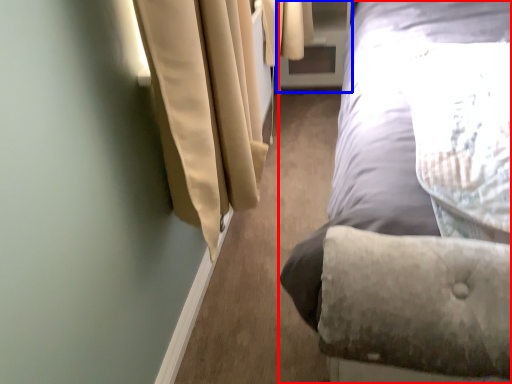
Question: Which object is further to the camera taking this photo, bed (highlighted by a red box) or screen door (highlighted by a blue box)?

Choices:
 (A) bed
 (B) screen door

Answer: (B)